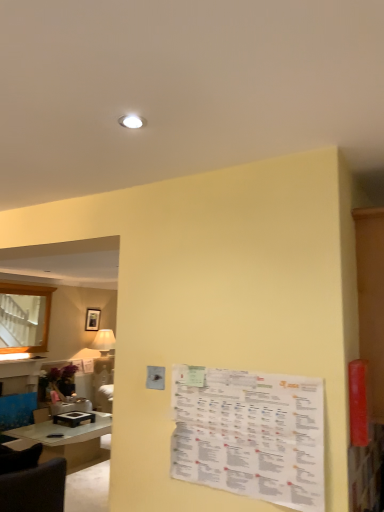
Question: Is matte black picture frame at upper center wider or thinner than clear glass table at lower left?

Choices:
 (A) wide
 (B) thin

Answer: (B)

Question: In the image, is matte black picture frame at upper center positioned in front of or behind clear glass table at lower left?

Choices:
 (A) front
 (B) behind

Answer: (B)

Question: Based on their relative distances, which object is nearer to the matte black picture frame at upper center?

Choices:
 (A) clear glass table at lower left
 (B) white paper menu at center

Answer: (A)

Question: Which is farther from the matte black picture frame at upper center?

Choices:
 (A) clear glass table at lower left
 (B) white paper menu at center

Answer: (B)